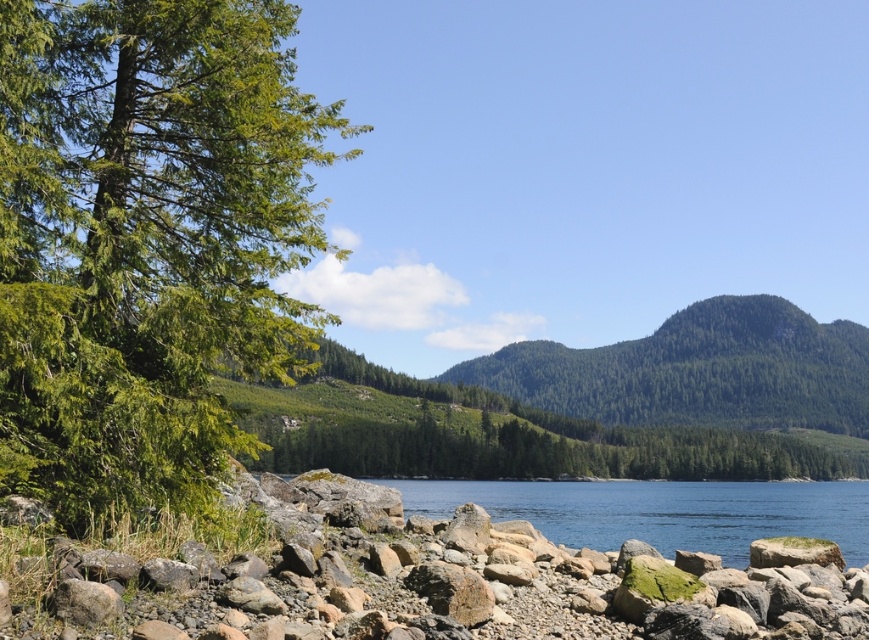
Question: Which point appears farthest from the camera in this image?

Choices:
 (A) (494, 634)
 (B) (682, 374)
 (C) (203, 90)

Answer: (B)

Question: Which point is farther to the camera?

Choices:
 (A) tap(851, 332)
 (B) tap(768, 632)

Answer: (A)

Question: Is green textured tree at left below green forested mountain at center?

Choices:
 (A) yes
 (B) no

Answer: (B)

Question: Which of the following is the closest to the observer?

Choices:
 (A) green textured tree at left
 (B) clear water at center
 (C) rusty stone boulder at lower left

Answer: (C)

Question: From the image, what is the correct spatial relationship of green forested mountain at center in relation to clear water at center?

Choices:
 (A) below
 (B) above

Answer: (B)

Question: Can you confirm if green textured tree at left is smaller than rusty stone boulder at lower left?

Choices:
 (A) no
 (B) yes

Answer: (B)